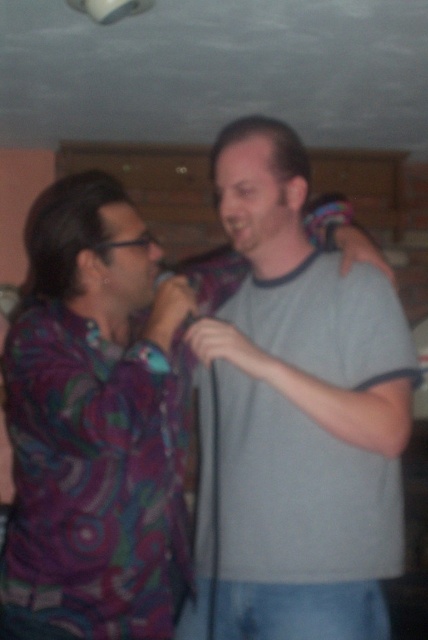
Question: Is gray cotton t-shirt at center closer to camera compared to matte black microphone at center?

Choices:
 (A) no
 (B) yes

Answer: (B)

Question: Among these objects, which one is farthest from the camera?

Choices:
 (A) gray cotton t-shirt at center
 (B) matte black microphone at center

Answer: (B)

Question: Is gray cotton t-shirt at center to the right of matte black microphone at center from the viewer's perspective?

Choices:
 (A) no
 (B) yes

Answer: (B)

Question: Does gray cotton t-shirt at center appear over matte black microphone at center?

Choices:
 (A) yes
 (B) no

Answer: (B)

Question: Which object appears closest to the camera in this image?

Choices:
 (A) gray cotton t-shirt at center
 (B) matte black microphone at center

Answer: (A)

Question: Which point is farther from the camera taking this photo?

Choices:
 (A) tap(155, 280)
 (B) tap(285, 372)

Answer: (A)